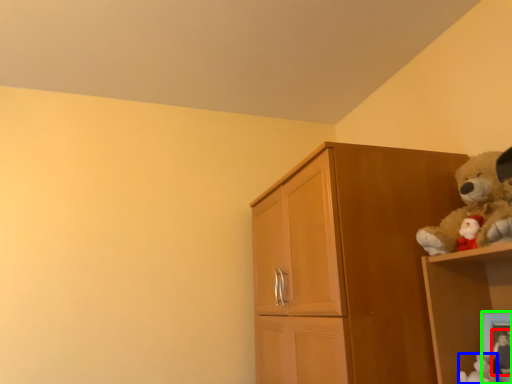
Question: Based on their relative distances, which object is farther from toy (highlighted by a red box)? Choose from toy (highlighted by a blue box) and picture frame (highlighted by a green box).

Choices:
 (A) toy
 (B) picture frame

Answer: (A)